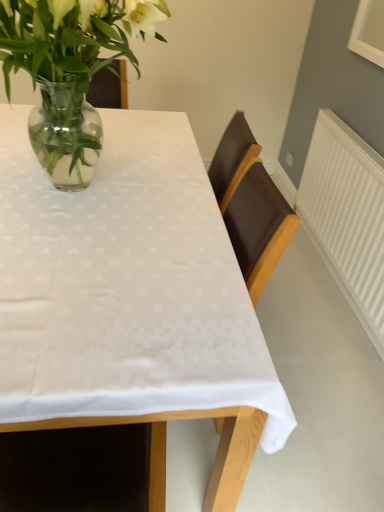
The width and height of the screenshot is (384, 512). Find the location of `white fabric table at center`. white fabric table at center is located at coordinates (131, 301).

Describe the element at coordinates (131, 301) in the screenshot. Image resolution: width=384 pixels, height=512 pixels. I see `white fabric table at center` at that location.

This screenshot has height=512, width=384. What do you see at coordinates (70, 71) in the screenshot?
I see `clear glass vase at upper left` at bounding box center [70, 71].

You are a GUI agent. You are given a task and a screenshot of the screen. Output one action in this format:
    pyautogui.click(x=<x>, y=<y>)
    Task: Click on the clear glass vase at upper left
    
    Given the screenshot: What is the action you would take?
    pyautogui.click(x=70, y=71)

The width and height of the screenshot is (384, 512). In order to click on white fabric table at center in this screenshot , I will do `click(131, 301)`.

Is white fabric table at center to the left or to the right of clear glass vase at upper left in the image?

white fabric table at center is to the left of clear glass vase at upper left.

Considering the positions of objects white fabric table at center and clear glass vase at upper left in the image provided, who is in front, white fabric table at center or clear glass vase at upper left?

white fabric table at center.

Is point (68, 314) in front of point (47, 6)?

Yes, point (68, 314) is in front of point (47, 6).

From the image's perspective, relative to clear glass vase at upper left, is white fabric table at center above or below?

white fabric table at center is below clear glass vase at upper left.

From a real-world perspective, which object stands above the other?

From a 3D spatial view, clear glass vase at upper left is above.

Considering the relative sizes of white fabric table at center and clear glass vase at upper left in the image provided, is white fabric table at center thinner than clear glass vase at upper left?

In fact, white fabric table at center might be wider than clear glass vase at upper left.

Is white fabric table at center shorter than clear glass vase at upper left?

No.

Considering the sizes of white fabric table at center and clear glass vase at upper left in the image, is white fabric table at center bigger or smaller than clear glass vase at upper left?

Considering their sizes, white fabric table at center takes up more space than clear glass vase at upper left.

Is white fabric table at center located outside clear glass vase at upper left?

Yes.

Does white fabric table at center touch clear glass vase at upper left?

No, white fabric table at center is not with clear glass vase at upper left.

Is white fabric table at center turned away from clear glass vase at upper left?

white fabric table at center does not have its back to clear glass vase at upper left.

Can you tell me how much white fabric table at center and clear glass vase at upper left differ in facing direction?

white fabric table at center and clear glass vase at upper left are facing 0.000417 degrees away from each other.

Measure the distance between white fabric table at center and clear glass vase at upper left.

white fabric table at center and clear glass vase at upper left are 14.41 inches apart from each other.

This screenshot has height=512, width=384. I want to click on table below the clear glass vase at upper left (from a real-world perspective), so click(131, 301).

Does clear glass vase at upper left appear on the right side of white fabric table at center?

Yes, clear glass vase at upper left is to the right of white fabric table at center.

Does clear glass vase at upper left come in front of white fabric table at center?

That is False.

Which is closer to the camera, (44, 21) or (100, 327)?

The point (100, 327) is closer.

From the image's perspective, is clear glass vase at upper left located above or below white fabric table at center?

From the image's perspective, clear glass vase at upper left appears above white fabric table at center.

Consider the image. From a real-world perspective, is clear glass vase at upper left above or below white fabric table at center?

clear glass vase at upper left is above white fabric table at center.

Can you confirm if clear glass vase at upper left is thinner than white fabric table at center?

Yes, clear glass vase at upper left is thinner than white fabric table at center.

Which of these two, clear glass vase at upper left or white fabric table at center, stands taller?

With more height is white fabric table at center.

Considering the relative sizes of clear glass vase at upper left and white fabric table at center in the image provided, is clear glass vase at upper left bigger than white fabric table at center?

No, clear glass vase at upper left is not bigger than white fabric table at center.

Is clear glass vase at upper left located outside white fabric table at center?

Yes, clear glass vase at upper left is not within white fabric table at center.

Is clear glass vase at upper left placed right next to white fabric table at center?

No, clear glass vase at upper left is not with white fabric table at center.

Is clear glass vase at upper left turned away from white fabric table at center?

That's not correct — clear glass vase at upper left is not looking away from white fabric table at center.

This screenshot has height=512, width=384. In order to click on table below the clear glass vase at upper left (from the image's perspective) in this screenshot , I will do `click(131, 301)`.

At what (x,y) coordinates should I click in order to perform the action: click on table on the left of the clear glass vase at upper left. Please return your answer as a coordinate pair (x, y). Looking at the image, I should click on (131, 301).

You are a GUI agent. You are given a task and a screenshot of the screen. Output one action in this format:
    pyautogui.click(x=<x>, y=<y>)
    Task: Click on the houseplant above the white fabric table at center (from a real-world perspective)
    The image size is (384, 512).
    Given the screenshot: What is the action you would take?
    pyautogui.click(x=70, y=71)